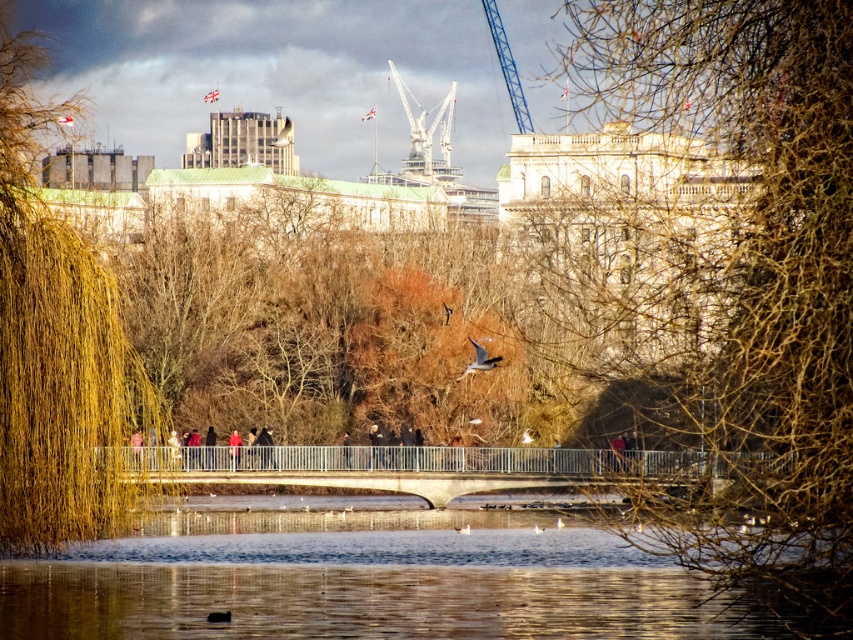
Question: Among these objects, which one is nearest to the camera?

Choices:
 (A) white metallic crane at upper center
 (B) blue metallic crane at upper center
 (C) yellow-green leafy tree at left
 (D) brown textured tree at center right

Answer: (D)

Question: Among these points, which one is nearest to the camera?

Choices:
 (A) (405, 102)
 (B) (233, 548)

Answer: (B)

Question: Can you confirm if blue metallic crane at upper center is thinner than red jacket at center?

Choices:
 (A) yes
 (B) no

Answer: (B)

Question: Can you confirm if brown textured tree at center right is positioned below transparent ice at center?

Choices:
 (A) yes
 (B) no

Answer: (B)

Question: Based on their relative distances, which object is nearer to the brown textured tree at center right?

Choices:
 (A) blue metallic crane at upper center
 (B) transparent ice at center
 (C) white metallic crane at upper center

Answer: (B)

Question: Is yellow-green leafy tree at left positioned in front of blue metallic crane at upper center?

Choices:
 (A) yes
 (B) no

Answer: (A)